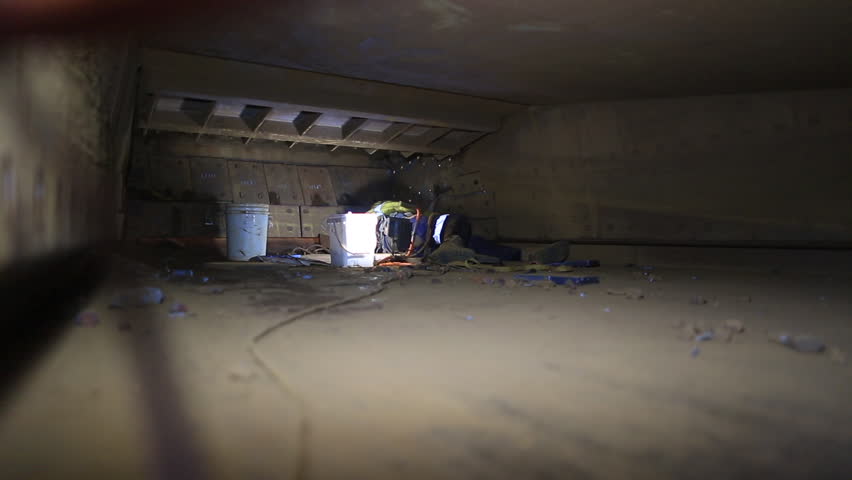
This screenshot has height=480, width=852. I want to click on background wall on right, so click(672, 170).